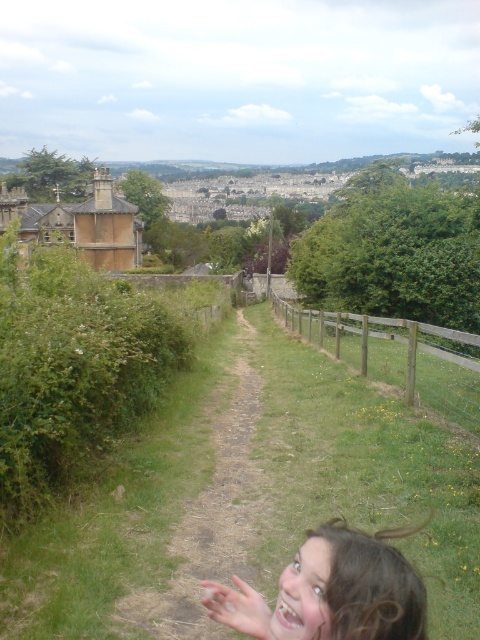
You are a gardener planning to mow the green grassy path at center and the wooden fence at right. Which area requires a smaller lawn mower to handle its dimensions?

The green grassy path at center requires a smaller lawn mower because it has a smaller size compared to the wooden fence at right.

You are standing at the center of the image and want to walk towards the green grassy path at center. In which direction should you move relative to your current position?

Since the green grassy path at center is located at point 0.806 on the x and 0.440 on the y axis, you should move towards the right and slightly forward to reach it.